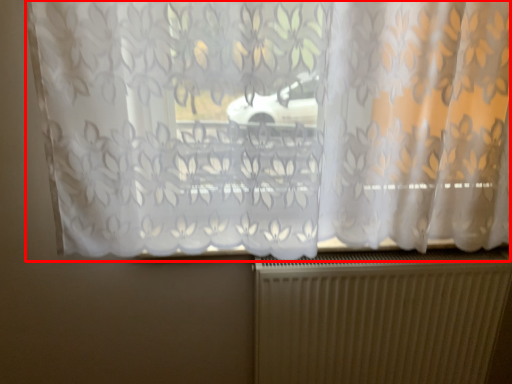
Question: From the image's perspective, considering the relative positions of curtain (annotated by the red box) and radiator in the image provided, where is curtain (annotated by the red box) located with respect to the staircase?

Choices:
 (A) above
 (B) below

Answer: (A)